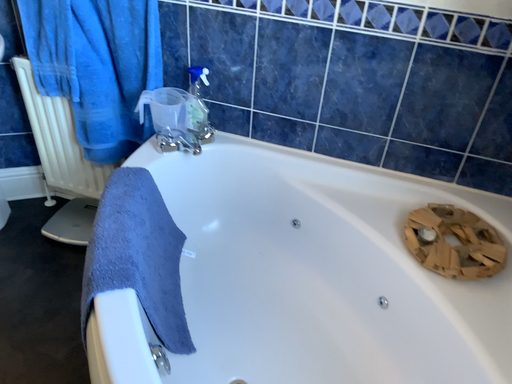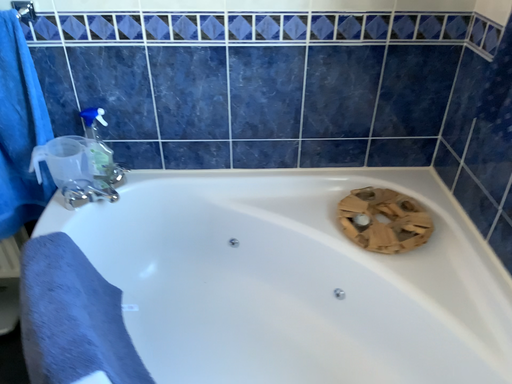
Question: Which way did the camera rotate in the video?

Choices:
 (A) rotated right
 (B) rotated left

Answer: (A)